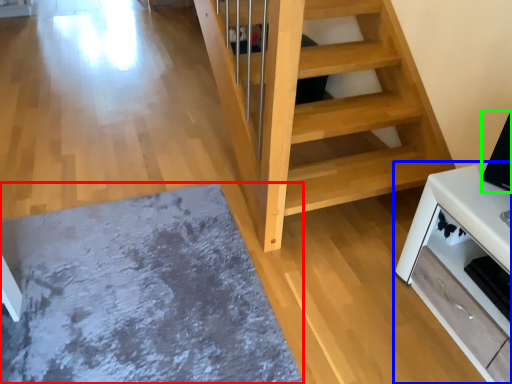
Question: Based on their relative distances, which object is nearer to mat (highlighted by a red box)? Choose from furniture (highlighted by a blue box) and appliance (highlighted by a green box).

Choices:
 (A) furniture
 (B) appliance

Answer: (A)